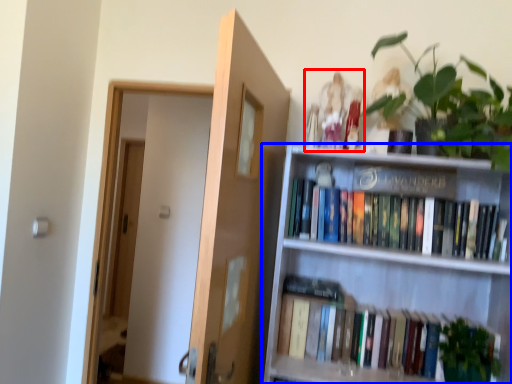
Question: Which point is closer to the camera, toy (highlighted by a red box) or shelf (highlighted by a blue box)?

Choices:
 (A) toy
 (B) shelf

Answer: (B)